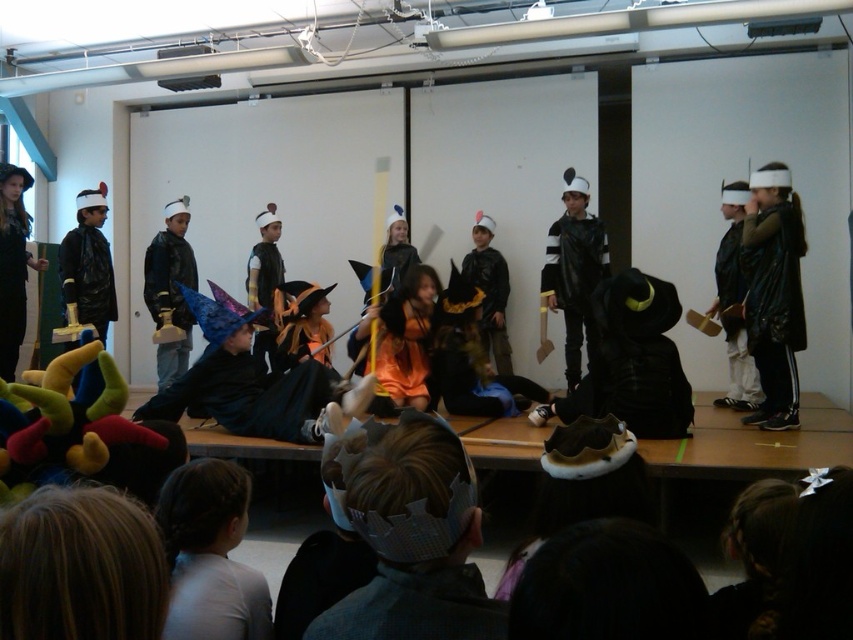
Question: Does orange matte dress at center appear under matte black cape at left?

Choices:
 (A) no
 (B) yes

Answer: (B)

Question: Can you confirm if black leather cape at right is positioned to the left of matte black cape at left?

Choices:
 (A) no
 (B) yes

Answer: (A)

Question: Which point is closer to the camera?

Choices:
 (A) (544, 275)
 (B) (788, 218)
 (C) (0, 252)

Answer: (B)

Question: Based on their relative distances, which object is nearer to the black matte cape at right?

Choices:
 (A) matte black cape at center
 (B) light brown hair at lower left
 (C) black leather cape at right
 (D) orange matte dress at center

Answer: (C)

Question: Which of the following is the closest to the observer?

Choices:
 (A) matte black wizard hat at left
 (B) black leather cape at right

Answer: (B)

Question: Does orange matte dress at center appear on the left side of matte black cape at left?

Choices:
 (A) no
 (B) yes

Answer: (A)